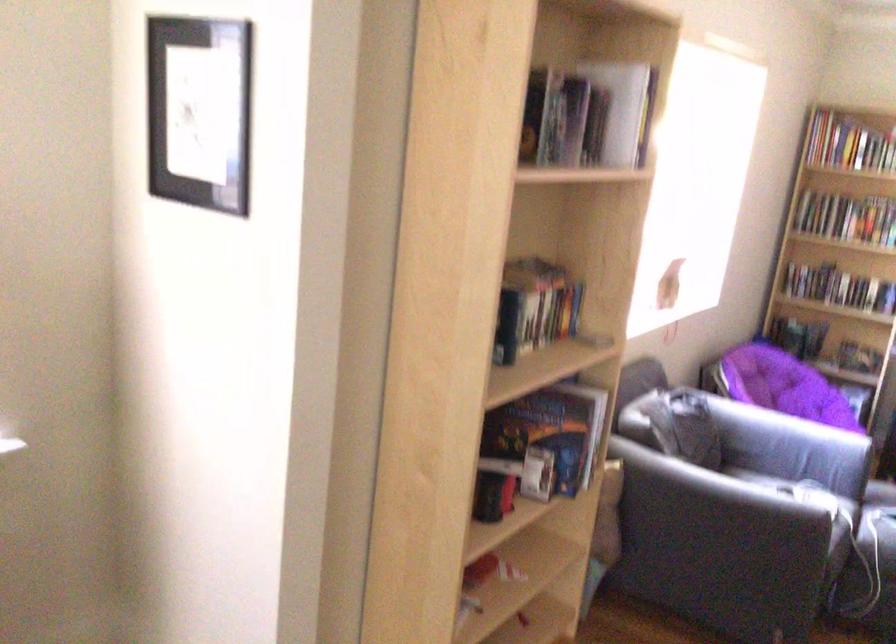
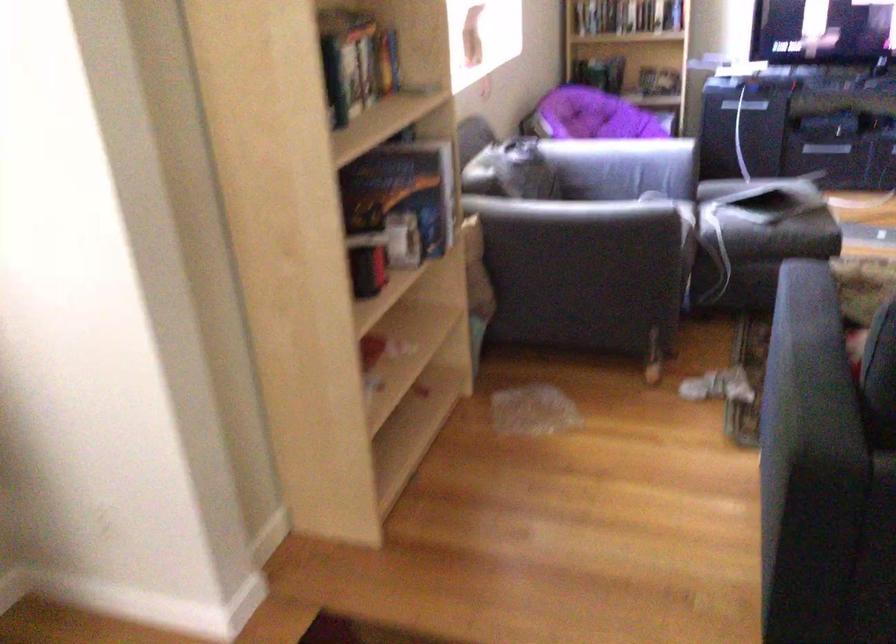
The point at (539, 301) is marked in the first image. Where is the corresponding point in the second image?

(358, 57)